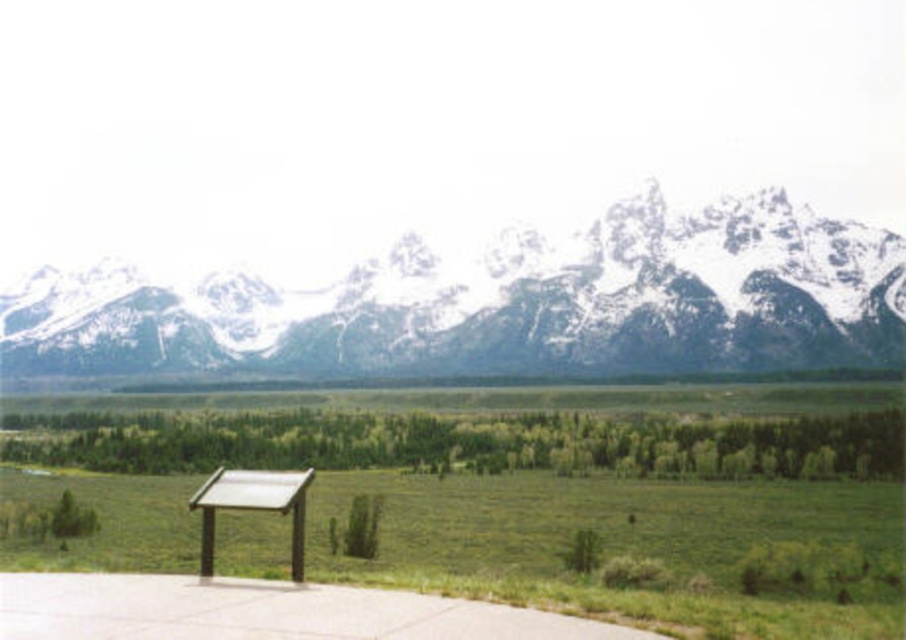
Is white snow-covered mountain range at upper center in front of wooden picnic table at lower left?

No, it is not.

Locate an element on the screen. This screenshot has height=640, width=906. white snow-covered mountain range at upper center is located at coordinates (497, 301).